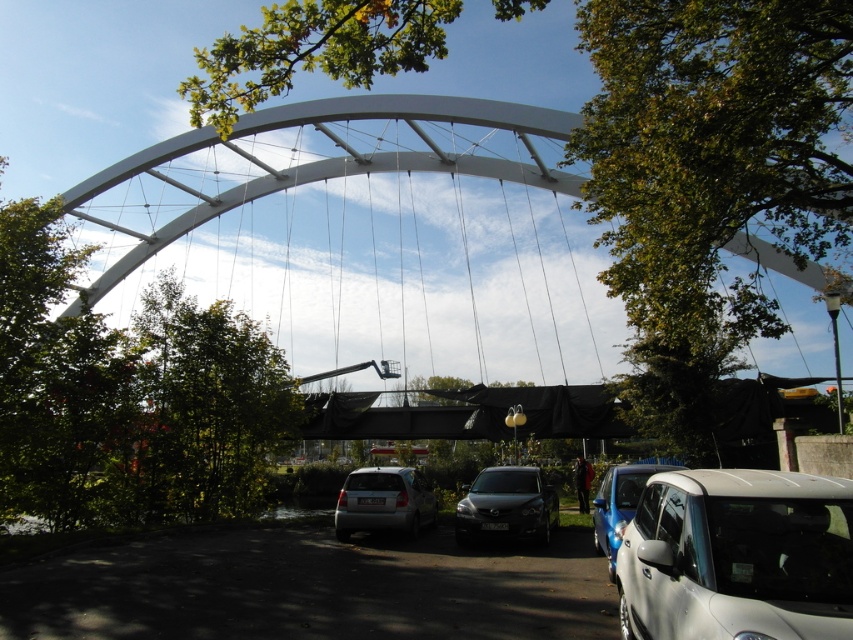
Is green leafy tree at center in front of dark gray metallic car at center?

Yes, it is in front of dark gray metallic car at center.

Which is behind, point (839, 198) or point (490, 484)?

Point (490, 484)

Locate an element on the screen. green leafy tree at center is located at coordinates (708, 173).

How far apart are dark gray metallic car at center and satin blue car at lower right?

7.25 feet

Can you confirm if dark gray metallic car at center is positioned below satin blue car at lower right?

Correct, dark gray metallic car at center is located below satin blue car at lower right.

Measure the distance between dark gray metallic car at center and camera.

dark gray metallic car at center is 11.47 meters away from camera.

This screenshot has height=640, width=853. I want to click on dark gray metallic car at center, so click(508, 506).

Who is more forward, (831, 196) or (751, 592)?

Point (751, 592) is more forward.

Who is more distant from viewer, [672,29] or [672,586]?

Positioned behind is point [672,29].

Locate an element on the screen. Image resolution: width=853 pixels, height=640 pixels. green leafy tree at center is located at coordinates (708, 173).

Where is `green leafy tree at center`? The height and width of the screenshot is (640, 853). green leafy tree at center is located at coordinates (708, 173).